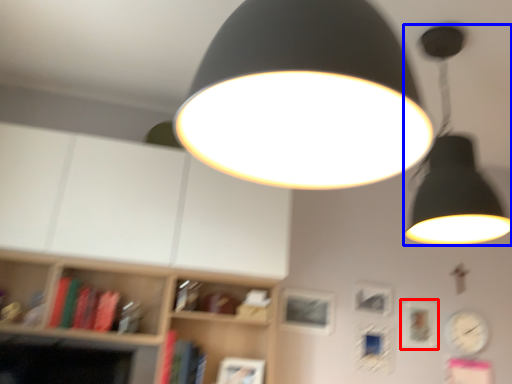
Question: Which point is further to the camera, picture frame (highlighted by a red box) or lamp (highlighted by a blue box)?

Choices:
 (A) picture frame
 (B) lamp

Answer: (A)